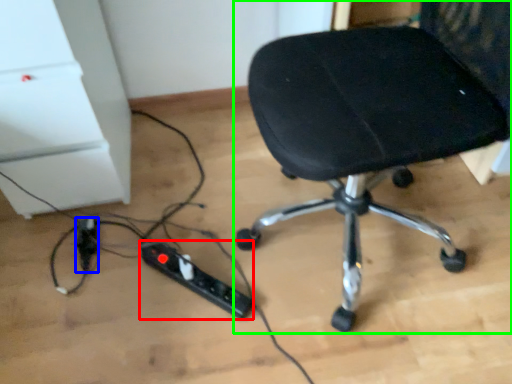
Question: Which is nearer to the extension cord (highlighted by a red box)? extension cord (highlighted by a blue box) or chair (highlighted by a green box).

Choices:
 (A) extension cord
 (B) chair

Answer: (A)